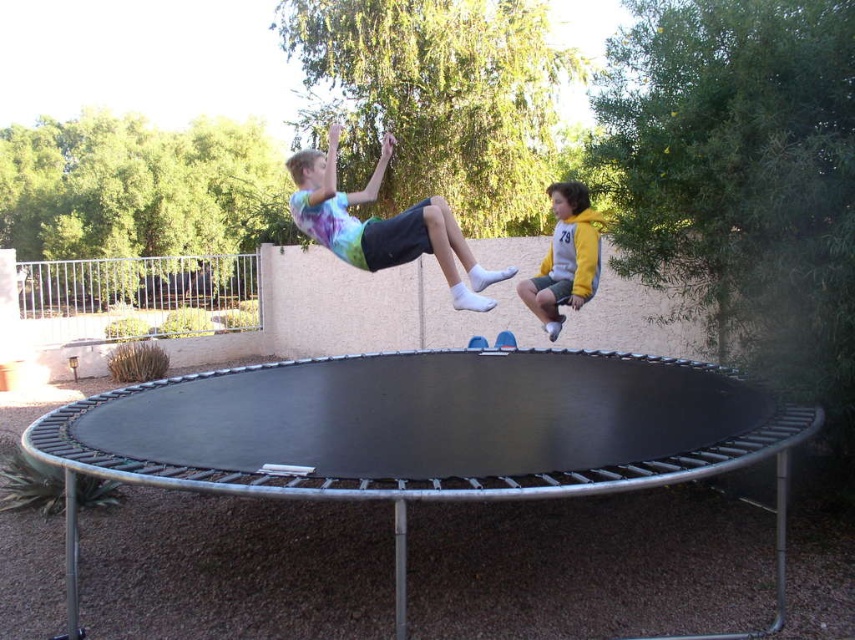
You are standing in the backyard looking at the trampoline. There is a point marked at coordinates [382,225]. Which object does this point correspond to?

The point at coordinates [382,225] corresponds to the tie dye fabric shirt at upper center.